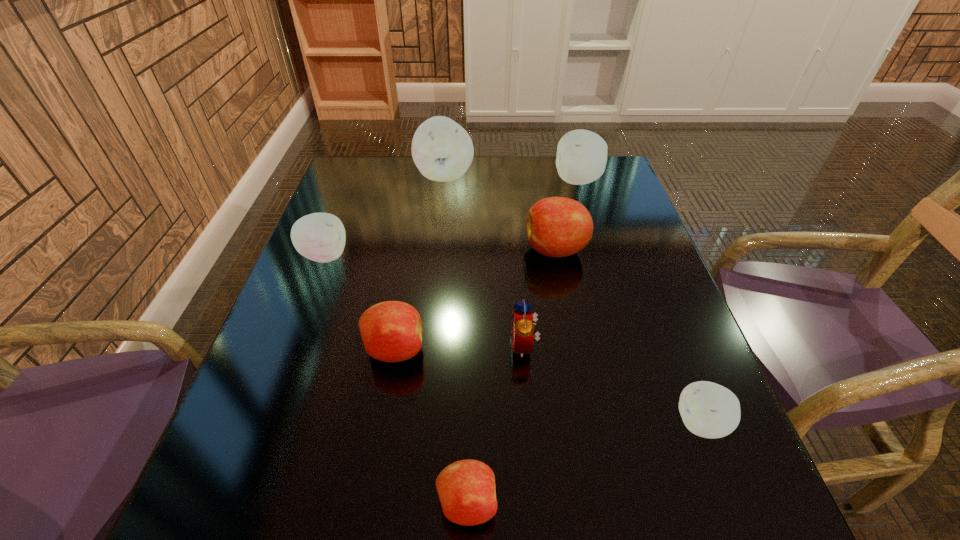
I want to click on the third white apple from right to left, so click(442, 150).

Where is `the tallest apple`? The height and width of the screenshot is (540, 960). the tallest apple is located at coordinates (442, 150).

Locate an element on the screen. the third smallest white apple is located at coordinates (581, 158).

The width and height of the screenshot is (960, 540). I want to click on the biggest red apple, so click(x=557, y=226).

The width and height of the screenshot is (960, 540). Find the location of `the rightmost red apple`. the rightmost red apple is located at coordinates (557, 226).

I want to click on the leftmost apple, so click(320, 237).

You are a GUI agent. You are given a task and a screenshot of the screen. Output one action in this format:
    pyautogui.click(x=<x>, y=<y>)
    Task: Click on the leftmost object
    The width and height of the screenshot is (960, 540).
    Given the screenshot: What is the action you would take?
    pyautogui.click(x=320, y=237)

I want to click on alarm clock, so click(522, 319).

Locate an element on the screen. The height and width of the screenshot is (540, 960). the third nearest apple is located at coordinates 391,331.

You are a GUI agent. You are given a task and a screenshot of the screen. Output one action in this format:
    pyautogui.click(x=<x>, y=<y>)
    Task: Click on the second farthest red apple
    This screenshot has width=960, height=540.
    Given the screenshot: What is the action you would take?
    pyautogui.click(x=391, y=331)